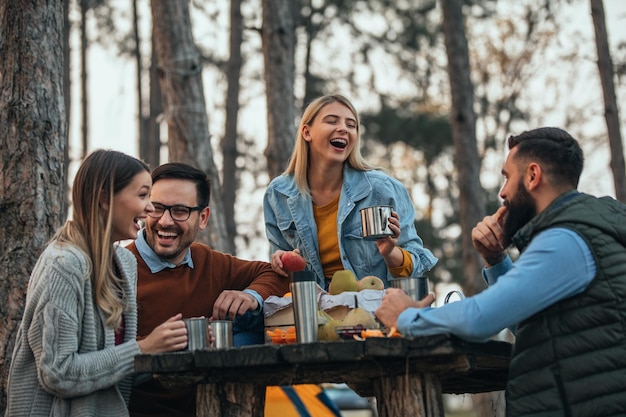
This screenshot has height=417, width=626. I want to click on metal cup, so click(305, 319), click(228, 331), click(203, 334), click(374, 223), click(409, 286).